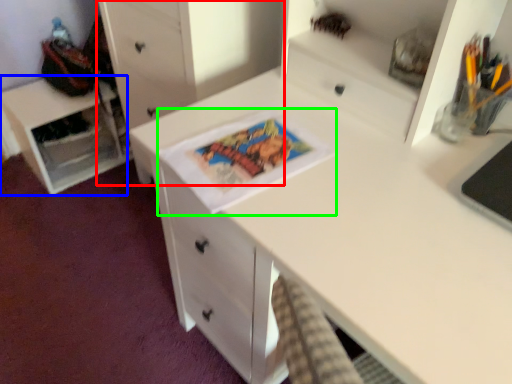
Question: Which object is the closest to the chest of drawers (highlighted by a red box)? Choose among these: cabinetry (highlighted by a blue box) or comic book (highlighted by a green box).

Choices:
 (A) cabinetry
 (B) comic book

Answer: (B)